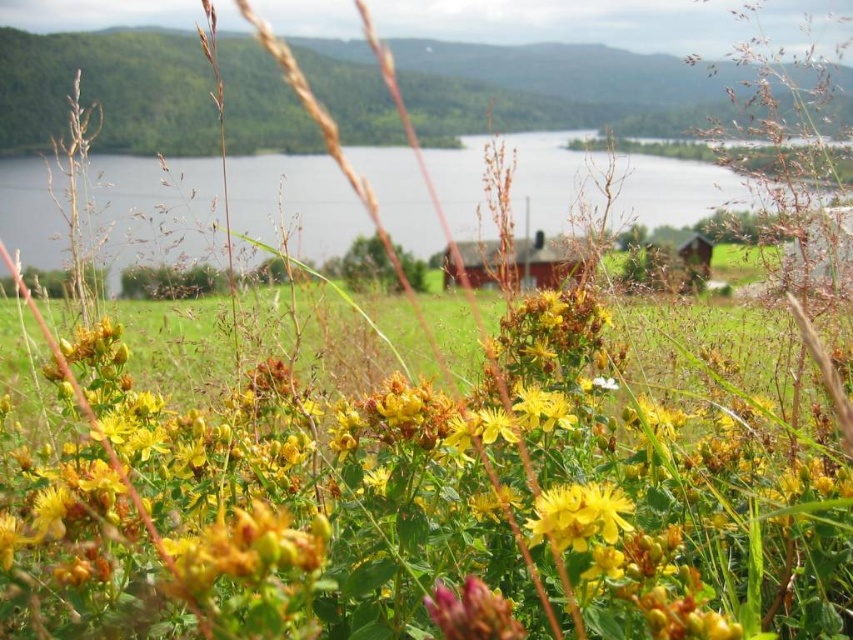
Describe the element at coordinates (405, 508) in the screenshot. I see `green leafy grass at center` at that location.

Can you confirm if green leafy grass at center is positioned below purple matte flower at lower center?

No, green leafy grass at center is not below purple matte flower at lower center.

Is point (396, 483) farther from viewer compared to point (503, 600)?

Yes, it is behind point (503, 600).

Locate an element on the screen. green leafy grass at center is located at coordinates (405, 508).

Is transparent water at center above red wooden hut at center?

Yes.

Which is more to the left, transparent water at center or red wooden hut at center?

Positioned to the left is transparent water at center.

Is point (479, 150) behind point (550, 266)?

Yes.

Find the location of a particular element. This screenshot has width=853, height=640. transparent water at center is located at coordinates (155, 205).

Can you confirm if red wooden hut at center is positioned above yellow matte flower at center?

Yes.

Can you confirm if red wooden hut at center is wider than yellow matte flower at center?

Yes.

The image size is (853, 640). Identify the location of red wooden hut at center. (521, 260).